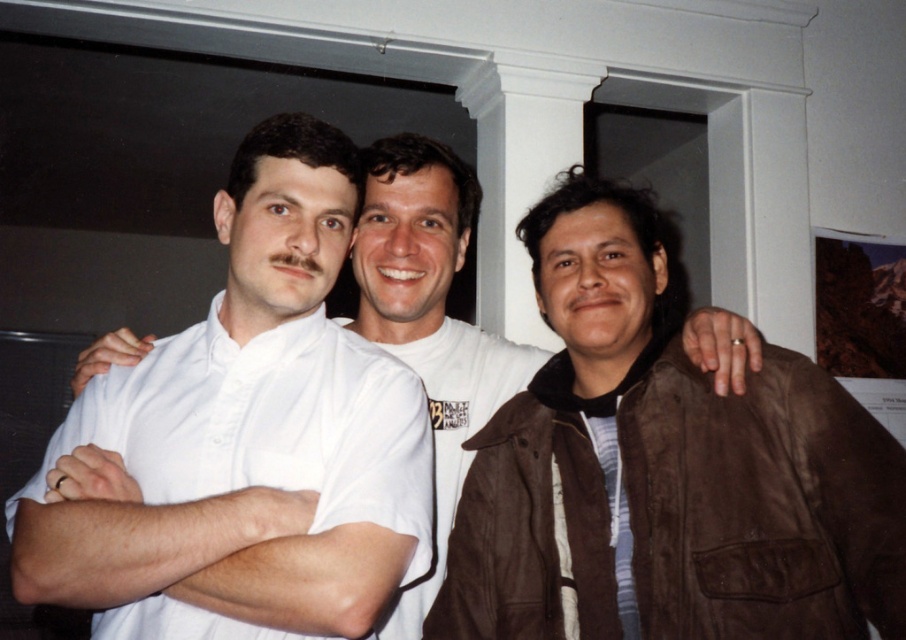
Can you confirm if white cotton shirt at left is positioned to the right of white shirt at center?

No, white cotton shirt at left is not to the right of white shirt at center.

What do you see at coordinates (265, 426) in the screenshot?
I see `white cotton shirt at left` at bounding box center [265, 426].

Where is `white cotton shirt at left`? The height and width of the screenshot is (640, 906). white cotton shirt at left is located at coordinates (265, 426).

Image resolution: width=906 pixels, height=640 pixels. In order to click on white cotton shirt at left in this screenshot , I will do `click(265, 426)`.

Describe the element at coordinates (682, 509) in the screenshot. I see `brown suede jacket at right` at that location.

Consider the image. Does brown suede jacket at right have a greater width compared to white cotton shirt at left?

Incorrect, brown suede jacket at right's width does not surpass white cotton shirt at left's.

Locate an element on the screen. The height and width of the screenshot is (640, 906). brown suede jacket at right is located at coordinates (682, 509).

What are the coordinates of `brown suede jacket at right` in the screenshot? It's located at (682, 509).

Is white cotton shirt at left bigger than striped cotton shirt at center?

Yes.

Identify the location of white cotton shirt at left. (265, 426).